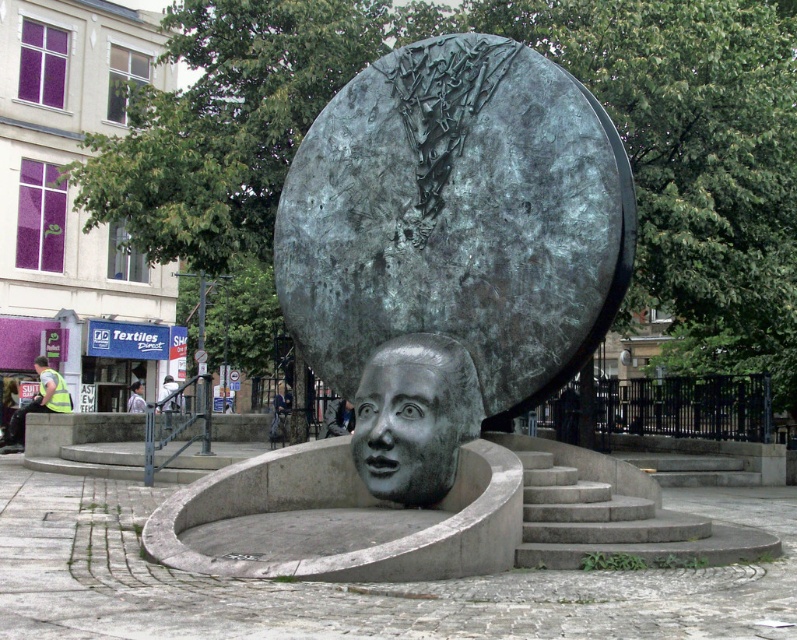
Which is above, bronze face at center or bronze sculpture at center?

bronze sculpture at center is higher up.

Can you confirm if bronze face at center is wider than bronze sculpture at center?

No, bronze face at center is not wider than bronze sculpture at center.

Locate an element on the screen. The image size is (797, 640). bronze face at center is located at coordinates (403, 433).

You are a GUI agent. You are given a task and a screenshot of the screen. Output one action in this format:
    pyautogui.click(x=<x>, y=<y>)
    Task: Click on the bronze face at center
    
    Given the screenshot: What is the action you would take?
    pyautogui.click(x=403, y=433)

Which is more to the left, bronze textured sphere at center or bronze face at center?

bronze face at center

You are a GUI agent. You are given a task and a screenshot of the screen. Output one action in this format:
    pyautogui.click(x=<x>, y=<y>)
    Task: Click on the bronze textured sphere at center
    
    Given the screenshot: What is the action you would take?
    pyautogui.click(x=450, y=248)

Does bronze face at center appear on the left side of reflective silver helmet at lower left?

In fact, bronze face at center is to the right of reflective silver helmet at lower left.

Does bronze face at center appear under reflective silver helmet at lower left?

Actually, bronze face at center is above reflective silver helmet at lower left.

Which is in front, point (436, 371) or point (46, 404)?

Point (436, 371) is more forward.

This screenshot has height=640, width=797. Identify the location of bronze face at center. (403, 433).